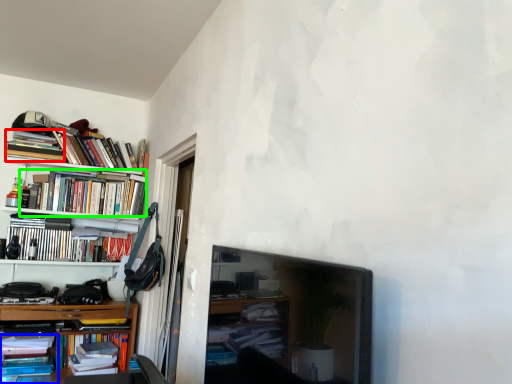
Question: Which object is the closest to the book (highlighted by a red box)? Choose among these: book (highlighted by a blue box) or book (highlighted by a green box).

Choices:
 (A) book
 (B) book

Answer: (B)